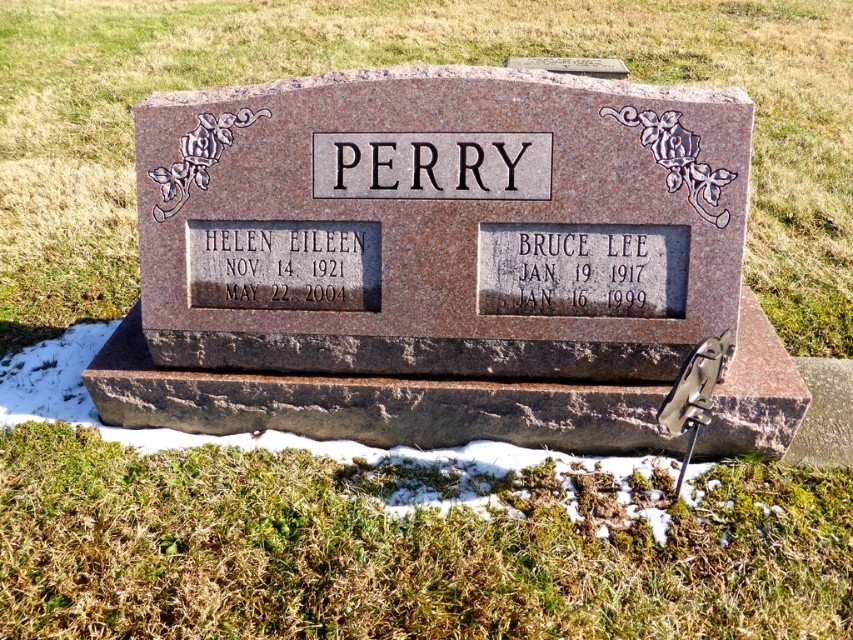
Question: Can you confirm if brown polished stone monument at center is positioned to the left of green grass at lower center?

Choices:
 (A) yes
 (B) no

Answer: (B)

Question: Can you confirm if brown polished stone monument at center is positioned to the right of green grass at lower center?

Choices:
 (A) yes
 (B) no

Answer: (A)

Question: Is green grass at lower center smaller than gray stone plaque at right?

Choices:
 (A) no
 (B) yes

Answer: (A)

Question: Which point is farther to the camera?

Choices:
 (A) click(471, 221)
 (B) click(352, 561)
 (C) click(555, 244)

Answer: (C)

Question: Which is farther from the black granite text at lower left?

Choices:
 (A) gray stone plaque at right
 (B) brown polished stone monument at center
 (C) green grass at lower center

Answer: (C)

Question: Which point is closer to the camera?

Choices:
 (A) brown polished stone monument at center
 (B) black granite text at lower left
 (C) green grass at lower center

Answer: (C)